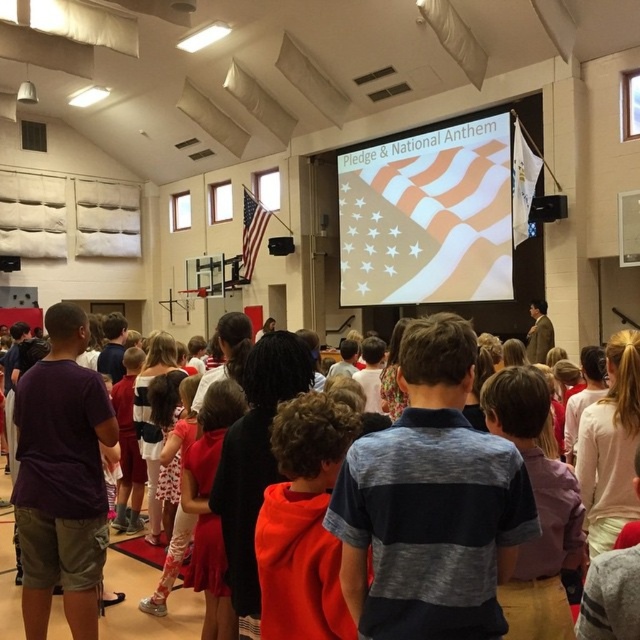
Question: Can you confirm if white fabric flag at upper center is bigger than white fabric flag at upper right?

Choices:
 (A) yes
 (B) no

Answer: (A)

Question: Which point appears farthest from the camera in this image?

Choices:
 (A) (296, 512)
 (B) (243, 257)
 (C) (417, 557)
 (D) (419, 182)

Answer: (B)

Question: Does white fabric flag at upper center appear under white fabric flag at upper right?

Choices:
 (A) yes
 (B) no

Answer: (A)

Question: Which object appears closest to the camera in this image?

Choices:
 (A) matte american flag at upper center
 (B) white fabric flag at upper right
 (C) white fabric flag at upper center

Answer: (B)

Question: Does orange hoodie at center lie behind white fabric flag at upper right?

Choices:
 (A) no
 (B) yes

Answer: (A)

Question: Which object is the closest to the matte red dress at center?

Choices:
 (A) white fabric flag at upper right
 (B) gray striped shirt at center
 (C) matte american flag at upper center
 (D) white fabric flag at upper center

Answer: (B)